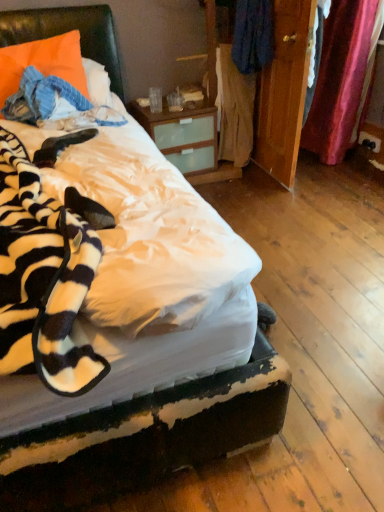
At what (x,y) coordinates should I click in order to perform the action: click on wooden wardrobe at center. Please return your answer as a coordinate pair (x, y). The width and height of the screenshot is (384, 512). Looking at the image, I should click on (284, 91).

The width and height of the screenshot is (384, 512). Describe the element at coordinates (43, 63) in the screenshot. I see `orange fabric pillow at upper left` at that location.

Measure the distance between blue fabric at center, marked as the second clothing in a bottom-to-top arrangement, and camera.

The depth of blue fabric at center, marked as the second clothing in a bottom-to-top arrangement, is 2.39 meters.

What do you see at coordinates (234, 109) in the screenshot?
I see `light brown fabric at center, the 2th clothing when ordered from top to bottom` at bounding box center [234, 109].

This screenshot has width=384, height=512. Find the location of `black plastic power outlet at lower right`. black plastic power outlet at lower right is located at coordinates (370, 141).

Is black plastic power outlet at lower right shorter than orange fabric pillow at upper left?

Correct, black plastic power outlet at lower right is not as tall as orange fabric pillow at upper left.

Can you tell me how much black plastic power outlet at lower right and orange fabric pillow at upper left differ in facing direction?

90.6 degrees.

From a real-world perspective, is black plastic power outlet at lower right on orange fabric pillow at upper left?

Incorrect, from a real-world perspective, black plastic power outlet at lower right is lower than orange fabric pillow at upper left.

Is black plastic power outlet at lower right positioned beyond the bounds of orange fabric pillow at upper left?

black plastic power outlet at lower right is positioned outside orange fabric pillow at upper left.

How far apart are black plastic power outlet at lower right and blue fabric at center, marked as the second clothing in a bottom-to-top arrangement?

They are 3.98 feet apart.

From a real-world perspective, which clothing is the 2nd one above the black plastic power outlet at lower right? Please provide its 2D coordinates.

[(253, 35)]

From a real-world perspective, is black plastic power outlet at lower right positioned above or below blue fabric at center, marked as the second clothing in a bottom-to-top arrangement?

In terms of real-world spatial position, black plastic power outlet at lower right is below blue fabric at center, marked as the second clothing in a bottom-to-top arrangement.

Between black plastic power outlet at lower right and blue fabric at center, marked as the second clothing in a bottom-to-top arrangement, which one has smaller size?

black plastic power outlet at lower right.

From a real-world perspective, is light brown fabric at center, the 2th clothing when ordered from top to bottom, positioned above or below black plastic power outlet at lower right?

light brown fabric at center, the 2th clothing when ordered from top to bottom, is above black plastic power outlet at lower right.

Is light brown fabric at center, the 2th clothing when ordered from top to bottom, facing away from black plastic power outlet at lower right?

light brown fabric at center, the 2th clothing when ordered from top to bottom, is not turned away from black plastic power outlet at lower right.

From the picture: Is light brown fabric at center, which ranks as the 1th clothing in bottom-to-top order, spatially inside black plastic power outlet at lower right, or outside of it?

light brown fabric at center, which ranks as the 1th clothing in bottom-to-top order, cannot be found inside black plastic power outlet at lower right.

Considering the relative sizes of light brown fabric at center, the 2th clothing when ordered from top to bottom, and black plastic power outlet at lower right in the image provided, is light brown fabric at center, the 2th clothing when ordered from top to bottom, smaller than black plastic power outlet at lower right?

No, light brown fabric at center, the 2th clothing when ordered from top to bottom, is not smaller than black plastic power outlet at lower right.

From the image's perspective, does light brown fabric at center, the 2th clothing when ordered from top to bottom, appear lower than orange fabric pillow at upper left?

No.

Considering the relative sizes of light brown fabric at center, which ranks as the 1th clothing in bottom-to-top order, and orange fabric pillow at upper left in the image provided, is light brown fabric at center, which ranks as the 1th clothing in bottom-to-top order, smaller than orange fabric pillow at upper left?

Incorrect, light brown fabric at center, which ranks as the 1th clothing in bottom-to-top order, is not smaller in size than orange fabric pillow at upper left.

The image size is (384, 512). Identify the location of pillow located on the left of light brown fabric at center, the 2th clothing when ordered from top to bottom. (43, 63).

Based on their sizes in the image, would you say orange fabric pillow at upper left is bigger or smaller than wooden wardrobe at center?

In the image, orange fabric pillow at upper left appears to be larger than wooden wardrobe at center.

Is orange fabric pillow at upper left aimed at wooden wardrobe at center?

No, orange fabric pillow at upper left is not turned towards wooden wardrobe at center.

Is orange fabric pillow at upper left shorter than wooden wardrobe at center?

Yes.

Is orange fabric pillow at upper left not near wooden wardrobe at center?

Yes.

Is orange fabric pillow at upper left at the back of wooden wardrobe at center?

No, orange fabric pillow at upper left is not at the back of wooden wardrobe at center.

Is wooden wardrobe at center bigger than orange fabric pillow at upper left?

Actually, wooden wardrobe at center might be smaller than orange fabric pillow at upper left.

Who is taller, wooden wardrobe at center or orange fabric pillow at upper left?

Standing taller between the two is wooden wardrobe at center.

In the image, is wooden wardrobe at center positioned in front of or behind orange fabric pillow at upper left?

In the image, wooden wardrobe at center appears behind orange fabric pillow at upper left.

Considering the relative sizes of light brown fabric at center, which ranks as the 1th clothing in bottom-to-top order, and blue fabric at center, marked as the second clothing in a bottom-to-top arrangement, in the image provided, is light brown fabric at center, which ranks as the 1th clothing in bottom-to-top order, shorter than blue fabric at center, marked as the second clothing in a bottom-to-top arrangement,?

Incorrect, the height of light brown fabric at center, which ranks as the 1th clothing in bottom-to-top order, does not fall short of that of blue fabric at center, marked as the second clothing in a bottom-to-top arrangement.

Image resolution: width=384 pixels, height=512 pixels. What are the coordinates of `clothing in front of the light brown fabric at center, which ranks as the 1th clothing in bottom-to-top order` in the screenshot? It's located at (253, 35).

From a real-world perspective, which object rests below the other?

light brown fabric at center, the 2th clothing when ordered from top to bottom, from a real-world perspective.

I want to click on pillow that appears above the black plastic power outlet at lower right (from the image's perspective), so [x=43, y=63].

I want to click on power outlet below the blue fabric at center, which appears as the first clothing when viewed from the top (from a real-world perspective), so click(370, 141).

Consider the image. Looking at the image, which one is located further to blue fabric at center, marked as the second clothing in a bottom-to-top arrangement, light brown fabric at center, the 2th clothing when ordered from top to bottom, or wooden wardrobe at center?

wooden wardrobe at center.

Based on their spatial positions, is orange fabric pillow at upper left or wooden wardrobe at center further from light brown fabric at center, the 2th clothing when ordered from top to bottom?

orange fabric pillow at upper left is positioned further to the anchor light brown fabric at center, the 2th clothing when ordered from top to bottom.

Which object lies further to the anchor point black plastic power outlet at lower right, wooden wardrobe at center or orange fabric pillow at upper left?

Among the two, orange fabric pillow at upper left is located further to black plastic power outlet at lower right.

From the image, which object appears to be farther from black plastic power outlet at lower right, blue fabric at center, marked as the second clothing in a bottom-to-top arrangement, or wooden wardrobe at center?

blue fabric at center, marked as the second clothing in a bottom-to-top arrangement.

Which object lies further to the anchor point black plastic power outlet at lower right, blue fabric at center, marked as the second clothing in a bottom-to-top arrangement, or light brown fabric at center, which ranks as the 1th clothing in bottom-to-top order?

blue fabric at center, marked as the second clothing in a bottom-to-top arrangement, is further to black plastic power outlet at lower right.

When comparing their distances from wooden wardrobe at center, does orange fabric pillow at upper left or blue fabric at center, marked as the second clothing in a bottom-to-top arrangement, seem closer?

blue fabric at center, marked as the second clothing in a bottom-to-top arrangement, lies closer to wooden wardrobe at center than the other object.

When comparing their distances from blue fabric at center, marked as the second clothing in a bottom-to-top arrangement, does light brown fabric at center, which ranks as the 1th clothing in bottom-to-top order, or orange fabric pillow at upper left seem closer?

light brown fabric at center, which ranks as the 1th clothing in bottom-to-top order, is closer to blue fabric at center, marked as the second clothing in a bottom-to-top arrangement.

Which object lies nearer to the anchor point light brown fabric at center, which ranks as the 1th clothing in bottom-to-top order, wooden wardrobe at center or blue fabric at center, which appears as the first clothing when viewed from the top?

The object closer to light brown fabric at center, which ranks as the 1th clothing in bottom-to-top order, is blue fabric at center, which appears as the first clothing when viewed from the top.

Where is `armoire between light brown fabric at center, which ranks as the 1th clothing in bottom-to-top order, and black plastic power outlet at lower right`? This screenshot has height=512, width=384. armoire between light brown fabric at center, which ranks as the 1th clothing in bottom-to-top order, and black plastic power outlet at lower right is located at coordinates (284, 91).

Locate an element on the screen. The image size is (384, 512). clothing between wooden wardrobe at center and light brown fabric at center, the 2th clothing when ordered from top to bottom, along the z-axis is located at coordinates (253, 35).

Locate an element on the screen. This screenshot has width=384, height=512. clothing between light brown fabric at center, which ranks as the 1th clothing in bottom-to-top order, and black plastic power outlet at lower right from left to right is located at coordinates (253, 35).

The height and width of the screenshot is (512, 384). I want to click on armoire between blue fabric at center, which appears as the first clothing when viewed from the top, and black plastic power outlet at lower right, in the horizontal direction, so click(284, 91).